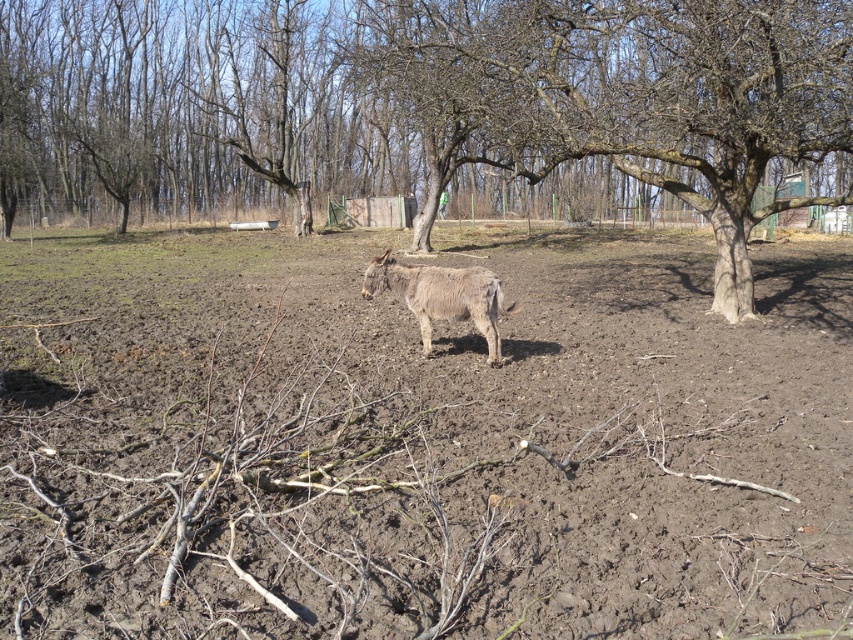
Question: Does brown soil at center appear on the left side of fuzzy brown donkey at center?

Choices:
 (A) no
 (B) yes

Answer: (B)

Question: Which point is closer to the camera?

Choices:
 (A) brown soil at center
 (B) fuzzy brown donkey at center
 (C) bare bark tree at center

Answer: (A)

Question: Which is farther from the bare bark tree at center?

Choices:
 (A) brown soil at center
 (B) fuzzy brown donkey at center

Answer: (B)

Question: Is bare bark tree at center positioned behind fuzzy brown donkey at center?

Choices:
 (A) yes
 (B) no

Answer: (B)

Question: Does brown soil at center have a lesser width compared to bare bark tree at center?

Choices:
 (A) no
 (B) yes

Answer: (A)

Question: Which object is closer to the camera taking this photo?

Choices:
 (A) fuzzy brown donkey at center
 (B) brown soil at center

Answer: (B)